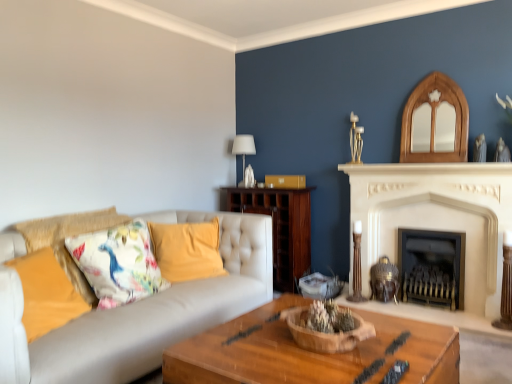
Question: Can you confirm if white stone fireplace at center, the 2th fireplace positioned from the right, is shorter than wooden coffee table at center?

Choices:
 (A) no
 (B) yes

Answer: (A)

Question: From a real-world perspective, is white stone fireplace at center, the 2th fireplace positioned from the right, under wooden coffee table at center?

Choices:
 (A) no
 (B) yes

Answer: (A)

Question: Considering the relative sizes of white stone fireplace at center, the 2th fireplace positioned from the right, and wooden coffee table at center in the image provided, is white stone fireplace at center, the 2th fireplace positioned from the right, taller than wooden coffee table at center?

Choices:
 (A) yes
 (B) no

Answer: (A)

Question: Is white stone fireplace at center, the first fireplace positioned from the left, outside wooden coffee table at center?

Choices:
 (A) yes
 (B) no

Answer: (A)

Question: Does white stone fireplace at center, the first fireplace positioned from the left, lie in front of wooden coffee table at center?

Choices:
 (A) yes
 (B) no

Answer: (B)

Question: Is wooden coffee table at center located within white stone fireplace at center, the first fireplace positioned from the left?

Choices:
 (A) no
 (B) yes

Answer: (A)

Question: From a real-world perspective, does yellow fabric pillow at center, acting as the second pillow starting from the front, stand above dark brown wood cabinet at center?

Choices:
 (A) no
 (B) yes

Answer: (B)

Question: Considering the relative positions of yellow fabric pillow at center, acting as the second pillow starting from the front, and dark brown wood cabinet at center in the image provided, is yellow fabric pillow at center, acting as the second pillow starting from the front, to the right of dark brown wood cabinet at center from the viewer's perspective?

Choices:
 (A) yes
 (B) no

Answer: (B)

Question: Is there a large distance between yellow fabric pillow at center, which ranks as the 1th pillow in right-to-left order, and dark brown wood cabinet at center?

Choices:
 (A) yes
 (B) no

Answer: (B)

Question: Is yellow fabric pillow at center, which is the second pillow from left to right, further to camera compared to dark brown wood cabinet at center?

Choices:
 (A) yes
 (B) no

Answer: (B)

Question: From a real-world perspective, is yellow fabric pillow at center, which is the first pillow in back-to-front order, beneath dark brown wood cabinet at center?

Choices:
 (A) no
 (B) yes

Answer: (A)

Question: Considering the relative sizes of yellow fabric pillow at center, which ranks as the 1th pillow in right-to-left order, and dark brown wood cabinet at center in the image provided, is yellow fabric pillow at center, which ranks as the 1th pillow in right-to-left order, smaller than dark brown wood cabinet at center?

Choices:
 (A) no
 (B) yes

Answer: (B)

Question: Is black metal fireplace at center, arranged as the 1th fireplace when viewed from the right, facing away from wooden bowl at center?

Choices:
 (A) no
 (B) yes

Answer: (A)